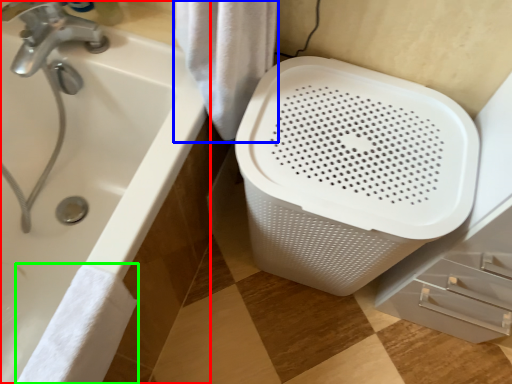
Question: Which object is positioned farthest from bathtub (highlighted by a red box)? Select from bath towel (highlighted by a blue box) and bath towel (highlighted by a green box).

Choices:
 (A) bath towel
 (B) bath towel

Answer: (A)